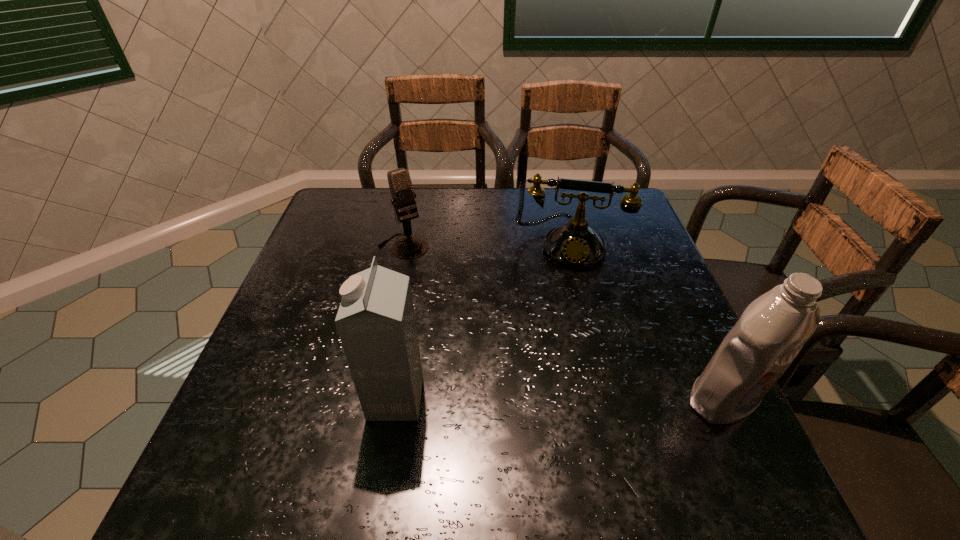
This screenshot has width=960, height=540. Find the location of `carton`. carton is located at coordinates (375, 321).

Image resolution: width=960 pixels, height=540 pixels. In order to click on detergent in this screenshot , I will do point(771,331).

Find the location of a particular element. microphone is located at coordinates (410, 247).

Identify the location of telephone. The width and height of the screenshot is (960, 540). (575, 245).

Where is `vacant space situated on the front label of the carton`? The image size is (960, 540). vacant space situated on the front label of the carton is located at coordinates (236, 398).

Image resolution: width=960 pixels, height=540 pixels. I want to click on vacant position located 0.050m on the front label of the carton, so click(345, 398).

In order to click on vacant space located on the front label of the carton in this screenshot , I will do `click(308, 398)`.

Identify the location of vacant space located 0.360m on the back of the detergent. The image size is (960, 540). (658, 260).

Locate an element on the screen. vacant region located on the front-facing side of the microphone is located at coordinates (421, 268).

Identify the location of vacant space located on the front-facing side of the microphone. This screenshot has width=960, height=540. (450, 309).